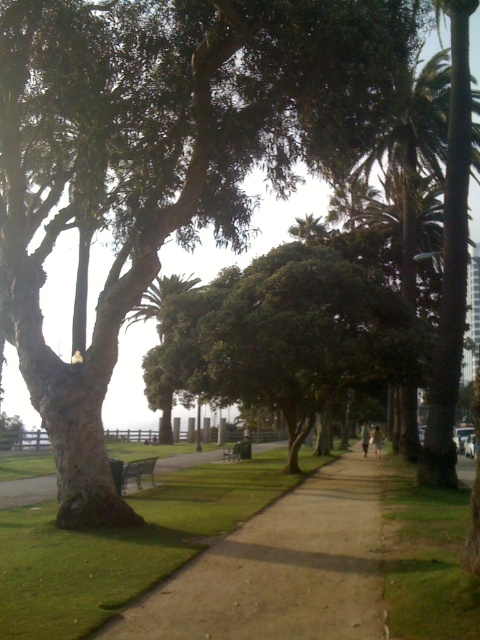
Question: Which of the following is the farthest from the observer?

Choices:
 (A) (217, 316)
 (B) (140, 308)

Answer: (B)

Question: Is green rough bark tree at center positioned before green leafy palm tree at center?

Choices:
 (A) yes
 (B) no

Answer: (A)

Question: Is green leafy tree at center positioned at the back of green leafy palm tree at center?

Choices:
 (A) yes
 (B) no

Answer: (A)

Question: Which of the following is the farthest from the observer?

Choices:
 (A) (127, 474)
 (B) (183, 288)
 (C) (250, 458)

Answer: (B)

Question: Which of the following is the farthest from the observer?

Choices:
 (A) (343, 310)
 (B) (291, 616)

Answer: (A)

Question: Is the position of green leafy palm tree at center less distant than that of wooden park bench at center?

Choices:
 (A) no
 (B) yes

Answer: (B)